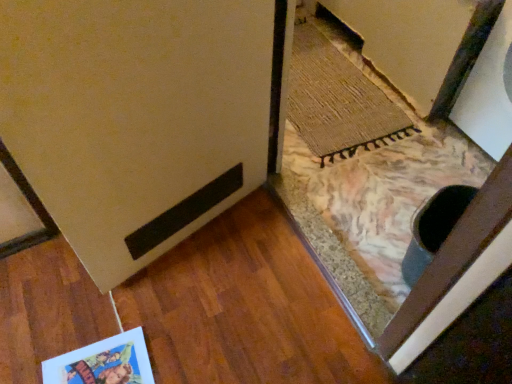
Question: Based on their sizes in the image, would you say rug at lower right is bigger or smaller than matte cardboard postcard at lower left?

Choices:
 (A) small
 (B) big

Answer: (B)

Question: Is rug at lower right to the left or to the right of matte cardboard postcard at lower left in the image?

Choices:
 (A) right
 (B) left

Answer: (A)

Question: Which of these objects is positioned farthest from the matte beige door at lower left?

Choices:
 (A) rug at lower right
 (B) matte cardboard postcard at lower left

Answer: (A)

Question: Which of these objects is positioned closest to the matte cardboard postcard at lower left?

Choices:
 (A) rug at lower right
 (B) matte beige door at lower left

Answer: (B)